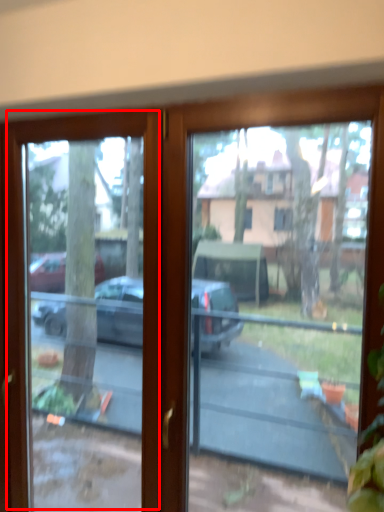
Question: From the image's perspective, what is the correct spatial relationship of screen door (annotated by the red box) in relation to bay window?

Choices:
 (A) above
 (B) below

Answer: (B)